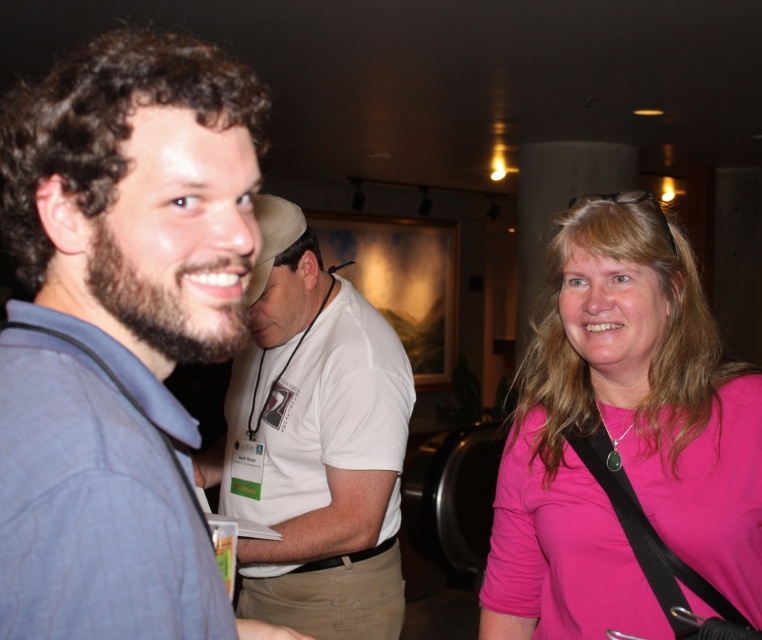
Question: Does pink matte shirt at upper right have a lesser width compared to blue cotton shirt at left?

Choices:
 (A) yes
 (B) no

Answer: (B)

Question: Does blue plaid shirt at left come behind pink matte shirt at upper right?

Choices:
 (A) no
 (B) yes

Answer: (A)

Question: Which point is closer to the camera taking this photo?

Choices:
 (A) (556, 362)
 (B) (287, 324)

Answer: (A)

Question: Which of the following is the farthest from the observer?

Choices:
 (A) blue cotton shirt at left
 (B) blue plaid shirt at left

Answer: (B)

Question: Among these points, which one is nearest to the camera?

Choices:
 (A) (136, 416)
 (B) (255, 436)

Answer: (A)

Question: Is blue plaid shirt at left above pink matte shirt at upper right?

Choices:
 (A) no
 (B) yes

Answer: (B)